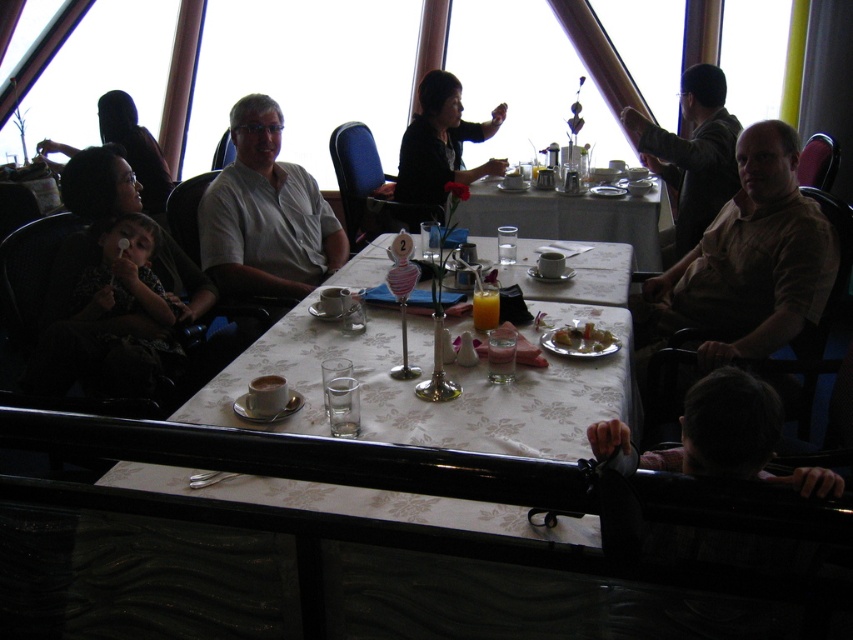
You are a server at a boat restaurant and need to deliver a dessert to the table. The dessert needs to be placed on the shiny silver plate at table center. However, there is a dark fabric child at left blocking the path. Can you place the dessert on the plate without moving the child?

The dark fabric child at left is above the shiny silver plate at table center, so the child is blocking the direct path to the plate. You will need to move the child or find an alternative route to place the dessert on the shiny silver plate at table center.

Based on the photo, you are a server in a boat restaurant and need to deliver a dessert to the dark fabric child at left and the shiny silver plate at table center. Which one is closer to the left side of the table?

The dark fabric child at left is closer to the left side of the table since it is positioned to the left of the shiny silver plate at table center.